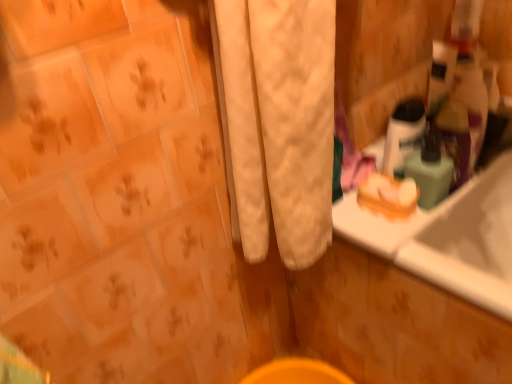
Question: Is point (391, 188) positioned closer to the camera than point (425, 155)?

Choices:
 (A) farther
 (B) closer

Answer: (A)

Question: Is orange matte soap at right inside or outside of green matte bottle at upper right, the 2th mouthwash in the left-to-right sequence?

Choices:
 (A) inside
 (B) outside

Answer: (B)

Question: Considering the real-world distances, which object is closest to the translucent plastic mouthwash at upper right, arranged as the second mouthwash when viewed from the right?

Choices:
 (A) green matte bottle at upper right, marked as the first mouthwash in a right-to-left arrangement
 (B) orange matte soap at right

Answer: (A)

Question: Which object is positioned farthest from the translucent plastic mouthwash at upper right, arranged as the second mouthwash when viewed from the right?

Choices:
 (A) orange matte soap at right
 (B) green matte bottle at upper right, the 2th mouthwash in the left-to-right sequence

Answer: (A)